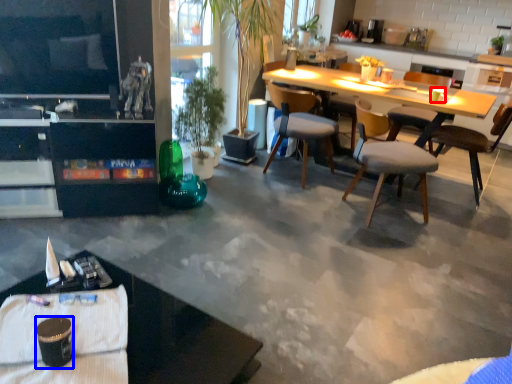
Question: Which point is further to the camera, coffee cup (highlighted by a red box) or coffee cup (highlighted by a blue box)?

Choices:
 (A) coffee cup
 (B) coffee cup

Answer: (A)